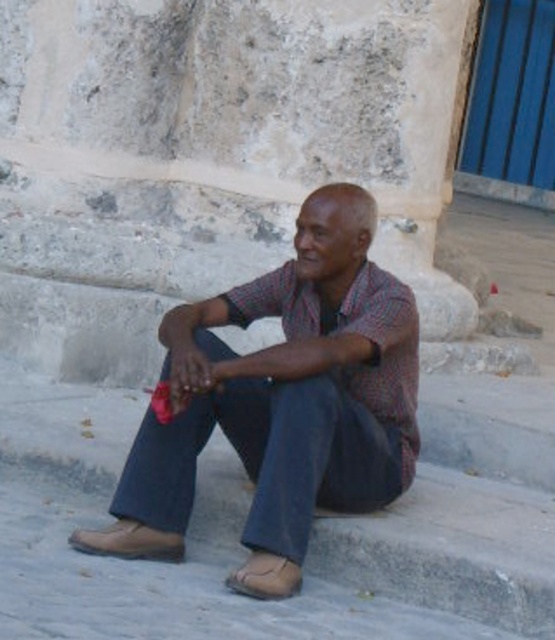
Is brown leather sandal at lower left further to camera compared to brown leather sandal at lower center?

Yes, it is.

Is brown leather sandal at lower left closer to the viewer compared to brown leather sandal at lower center?

That is False.

Does point (100, 538) come closer to viewer compared to point (264, 566)?

No, (100, 538) is behind (264, 566).

Locate an element on the screen. This screenshot has width=555, height=640. brown leather sandal at lower left is located at coordinates (128, 541).

Who is more distant from viewer, [180,476] or [275,584]?

The point [180,476] is behind.

Consider the image. Does checkered fabric shirt at center have a greater height compared to brown leather sandal at lower center?

Indeed, checkered fabric shirt at center has a greater height compared to brown leather sandal at lower center.

Measure the distance between point (280, 364) and camera.

The distance of point (280, 364) from camera is 36.57 feet.

Locate an element on the screen. Image resolution: width=555 pixels, height=640 pixels. checkered fabric shirt at center is located at coordinates (290, 387).

Does point (415, 356) come in front of point (130, 532)?

No, it is not.

Is checkered fabric shirt at center thinner than brown leather sandal at lower left?

No, checkered fabric shirt at center is not thinner than brown leather sandal at lower left.

Who is more distant from viewer, (215, 404) or (118, 541)?

Point (215, 404)

Identify the location of checkered fabric shirt at center. (290, 387).